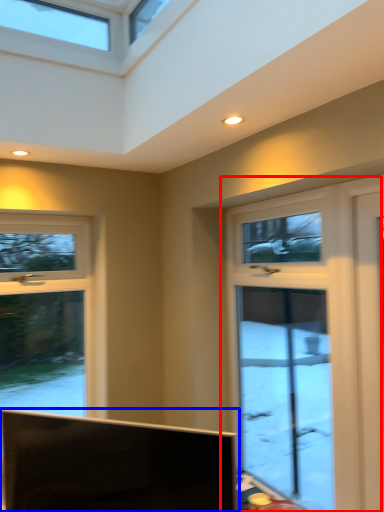
Question: Which object appears farthest to the camera in this image, window (highlighted by a red box) or television (highlighted by a blue box)?

Choices:
 (A) window
 (B) television

Answer: (A)